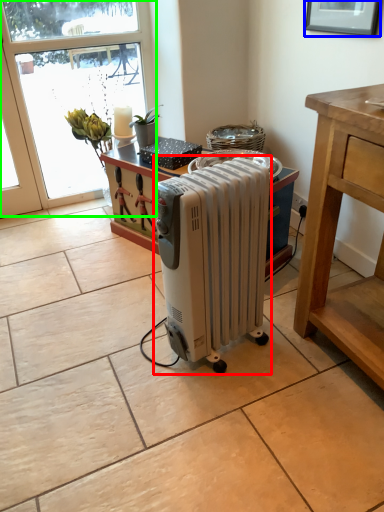
Question: Which is farther away from home appliance (highlighted by a red box)? picture frame (highlighted by a blue box) or window (highlighted by a green box)?

Choices:
 (A) picture frame
 (B) window

Answer: (B)